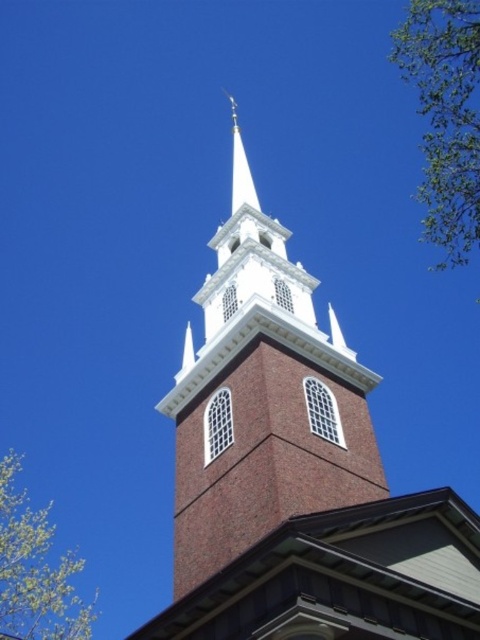
Question: Among these points, which one is farthest from the camera?

Choices:
 (A) (236, 124)
 (B) (191, 454)
 (C) (459, 113)
 (D) (21, 573)

Answer: (A)

Question: In this image, where is green leafy tree at upper right located relative to white smooth steeple at upper center?

Choices:
 (A) below
 (B) above

Answer: (B)

Question: Considering the relative positions of green leafy tree at upper right and green leafy tree at upper left in the image provided, where is green leafy tree at upper right located with respect to green leafy tree at upper left?

Choices:
 (A) above
 (B) below

Answer: (A)

Question: Which point is farther from the camera taking this photo?

Choices:
 (A) (189, 497)
 (B) (12, 568)

Answer: (B)

Question: Which object appears farthest from the camera in this image?

Choices:
 (A) green leafy tree at upper right
 (B) brick steeple at center

Answer: (A)

Question: From the image, what is the correct spatial relationship of green leafy tree at upper right in relation to green leafy tree at upper left?

Choices:
 (A) above
 (B) below

Answer: (A)